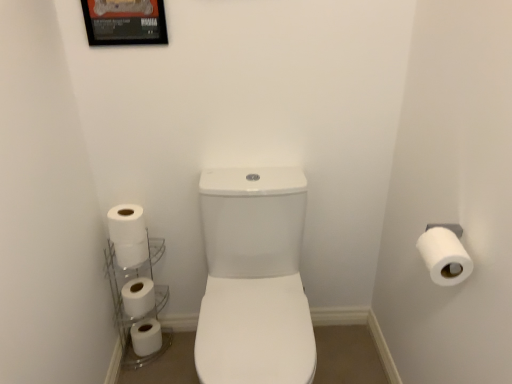
Question: From the image's perspective, does clear glass shelves at lower left appear lower than white matte toilet paper at right, the first toilet paper when ordered from front to back?

Choices:
 (A) yes
 (B) no

Answer: (A)

Question: Is clear glass shelves at lower left wider than white matte toilet paper at right, arranged as the 5th toilet paper when viewed from the left?

Choices:
 (A) yes
 (B) no

Answer: (A)

Question: Is white matte toilet paper at right, the 4th toilet paper in the bottom-to-top sequence, completely or partially inside clear glass shelves at lower left?

Choices:
 (A) yes
 (B) no

Answer: (B)

Question: Is clear glass shelves at lower left positioned in front of white matte toilet paper at right, the first toilet paper when ordered from front to back?

Choices:
 (A) no
 (B) yes

Answer: (A)

Question: Does clear glass shelves at lower left have a larger size compared to white matte toilet paper at right, the fifth toilet paper in the back-to-front sequence?

Choices:
 (A) yes
 (B) no

Answer: (A)

Question: Is point (129, 3) positioned closer to the camera than point (133, 316)?

Choices:
 (A) closer
 (B) farther

Answer: (A)

Question: Looking at the image, does metallic framed poster at upper left seem bigger or smaller compared to white matte toilet paper at lower left, the 4th toilet paper in the front-to-back sequence?

Choices:
 (A) small
 (B) big

Answer: (A)

Question: Considering the positions of metallic framed poster at upper left and white matte toilet paper at lower left, positioned as the 4th toilet paper in top-to-bottom order, in the image, is metallic framed poster at upper left taller or shorter than white matte toilet paper at lower left, positioned as the 4th toilet paper in top-to-bottom order,?

Choices:
 (A) short
 (B) tall

Answer: (B)

Question: Is metallic framed poster at upper left in front of or behind white matte toilet paper at lower left, marked as the 2th toilet paper in a back-to-front arrangement, in the image?

Choices:
 (A) front
 (B) behind

Answer: (A)

Question: Based on their sizes in the image, would you say white matte toilet paper at right, marked as the second toilet paper in a top-to-bottom arrangement, is bigger or smaller than white matte toilet paper at lower left, positioned as the 4th toilet paper in top-to-bottom order?

Choices:
 (A) big
 (B) small

Answer: (B)

Question: Is point (422, 248) positioned closer to the camera than point (146, 279)?

Choices:
 (A) closer
 (B) farther

Answer: (A)

Question: In the image, is white matte toilet paper at right, the first toilet paper when ordered from front to back, positioned in front of or behind white matte toilet paper at lower left, placed as the second toilet paper when sorted from left to right?

Choices:
 (A) front
 (B) behind

Answer: (A)

Question: From the image's perspective, is white matte toilet paper at right, the first toilet paper when ordered from front to back, positioned above or below white matte toilet paper at lower left, positioned as the 4th toilet paper in top-to-bottom order?

Choices:
 (A) above
 (B) below

Answer: (A)

Question: Considering the positions of white matte toilet paper at lower left, the fifth toilet paper viewed from the top, and metallic framed poster at upper left in the image, is white matte toilet paper at lower left, the fifth toilet paper viewed from the top, taller or shorter than metallic framed poster at upper left?

Choices:
 (A) tall
 (B) short

Answer: (B)

Question: In terms of width, does white matte toilet paper at lower left, marked as the 5th toilet paper in a right-to-left arrangement, look wider or thinner when compared to metallic framed poster at upper left?

Choices:
 (A) thin
 (B) wide

Answer: (B)